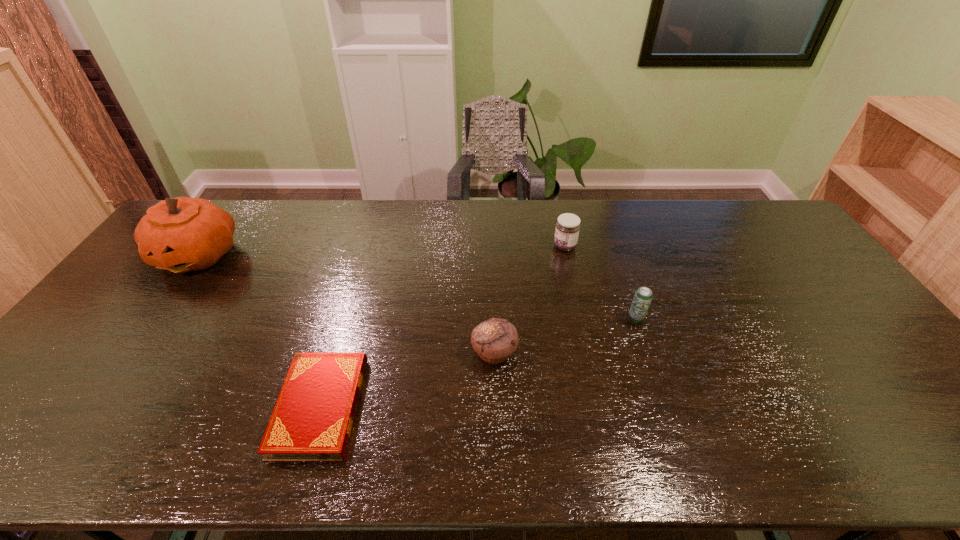
The height and width of the screenshot is (540, 960). I want to click on pumpkin, so click(x=181, y=234).

Locate an element on the screen. Image resolution: width=960 pixels, height=540 pixels. the leftmost object is located at coordinates (181, 234).

Find the location of `jam`. jam is located at coordinates (x=567, y=230).

The width and height of the screenshot is (960, 540). What are the coordinates of `beer can` in the screenshot? It's located at (643, 296).

What are the coordinates of `the rightmost object` in the screenshot? It's located at (643, 296).

Locate an element on the screen. The width and height of the screenshot is (960, 540). the third object from left to right is located at coordinates (495, 339).

Locate an element on the screen. The width and height of the screenshot is (960, 540). the shortest object is located at coordinates (312, 420).

Where is `hardback book`? hardback book is located at coordinates (312, 420).

You are a GUI agent. You are given a task and a screenshot of the screen. Output one action in this format:
    pyautogui.click(x=<x>, y=<y>)
    Task: Click on the vacant space located on the front-facing side of the leftmost object
    
    Given the screenshot: What is the action you would take?
    pyautogui.click(x=98, y=393)

The image size is (960, 540). I want to click on vacant space located 0.110m on the front label of the fourth object from left to right, so click(520, 246).